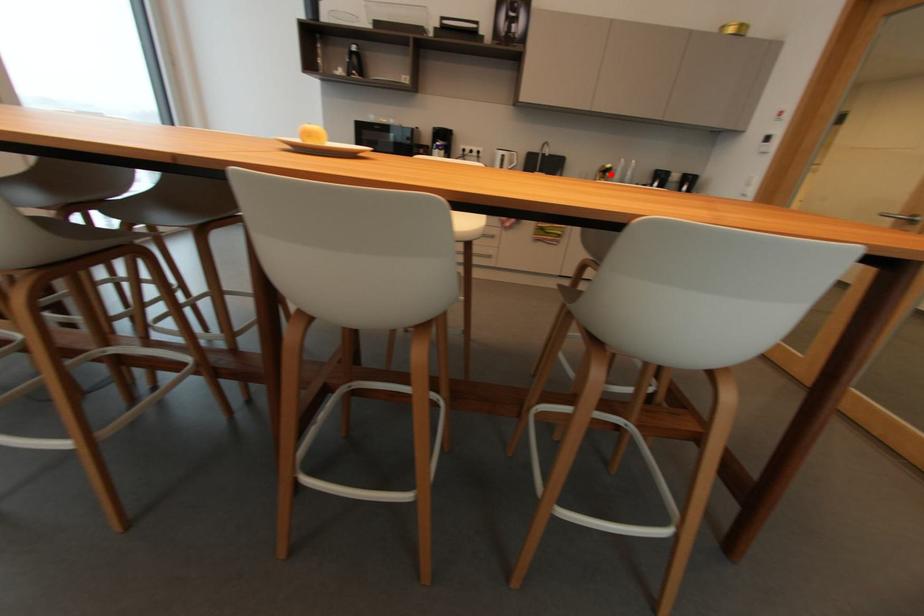
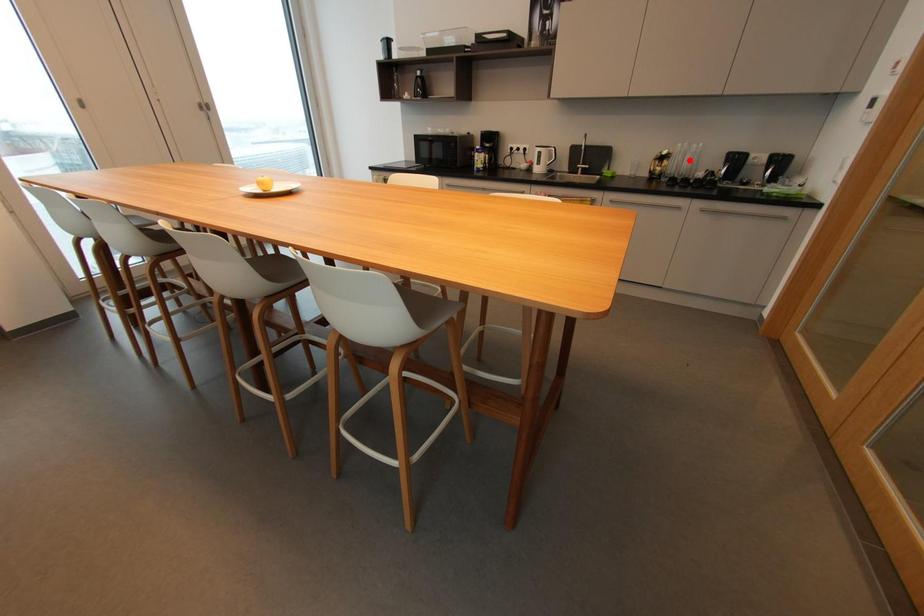
I am providing you with two images of the same scene from different viewpoints. A red point is marked on the first image and another point is marked on the second image. Are the points marked in image1 and image2 representing the same 3D position?

No